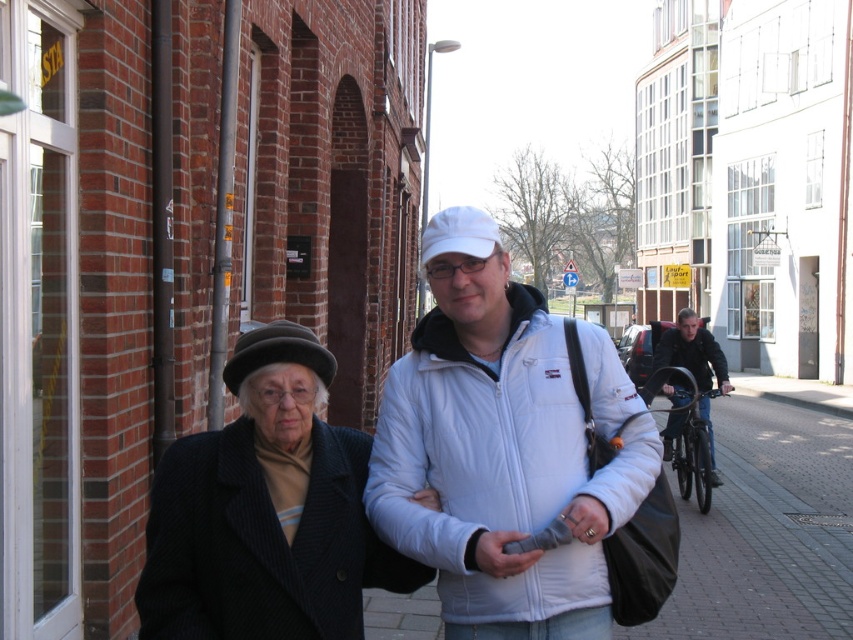
Is point (793, 588) positioned before point (502, 561)?

No, it is behind (502, 561).

Identify the location of white fabric jacket at center. The height and width of the screenshot is (640, 853). (766, 531).

This screenshot has width=853, height=640. Find the location of `white fabric jacket at center`. white fabric jacket at center is located at coordinates (766, 531).

Can you confirm if dark woolen coat at center is bigger than dark brown felt baseball hat at center?

Yes, dark woolen coat at center is bigger than dark brown felt baseball hat at center.

Is dark woolen coat at center above dark brown felt baseball hat at center?

No, dark woolen coat at center is not above dark brown felt baseball hat at center.

Between point (323, 355) and point (283, 342), which one is positioned behind?

The point (323, 355) is more distant.

Find the location of a particular element. The width and height of the screenshot is (853, 640). dark woolen coat at center is located at coordinates (265, 512).

Is the position of white fabric jacket at center less distant than that of dark brown felt baseball hat at center?

No, white fabric jacket at center is behind dark brown felt baseball hat at center.

Find the location of `white fabric jacket at center`. white fabric jacket at center is located at coordinates (766, 531).

Where is `white fabric jacket at center`? The image size is (853, 640). white fabric jacket at center is located at coordinates (766, 531).